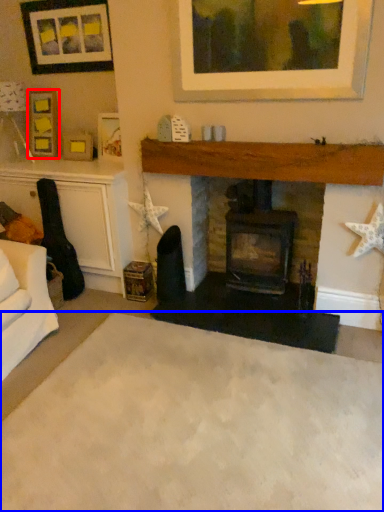
Question: Which point is further to the camera, picture frame (highlighted by a red box) or plain (highlighted by a blue box)?

Choices:
 (A) picture frame
 (B) plain

Answer: (A)